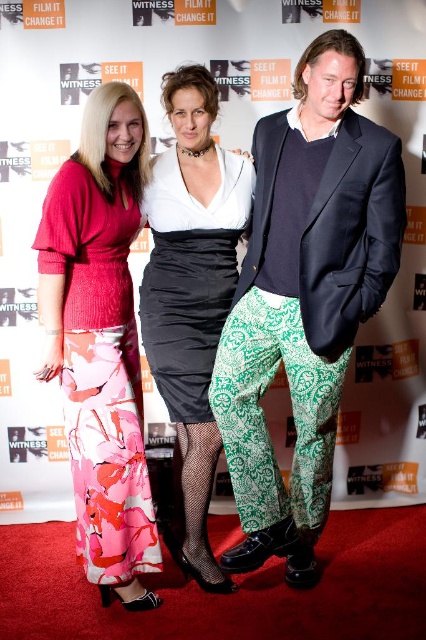
You are a photographer at the event and need to ensure that both the green printed pants at center and the satin dress at center are in focus. The camera you are using has a depth of field that can cover 30 centimeters. Can both items be captured clearly in the same photo?

The green printed pants at center is 28.35 centimeters from the satin dress at center. Since the distance between them is less than the camera s 30 centimeter depth of field, both items can be captured clearly in focus in the same photo.

You are organizing a photo shoot and need to determine if the green printed pants at center and the floral fabric dress at left can be displayed side by side in a 1.5 meter wide space. Based on their widths, will they fit together?

The green printed pants at center might be wider than the floral fabric dress at left, so their combined width could exceed 1.5 meters. It is uncertain if they will fit together without overlapping.

You are standing at the event and want to take a photo of the green printed pants at center. If your camera has a maximum focus range of 5 feet, will you need to move closer to get a clear shot?

The green printed pants at center are 6.03 feet away from you, which exceeds the camera maximum focus range of 5 feet. You need to move closer to ensure the green printed pants at center are within the 5 feet range for a clear photo.